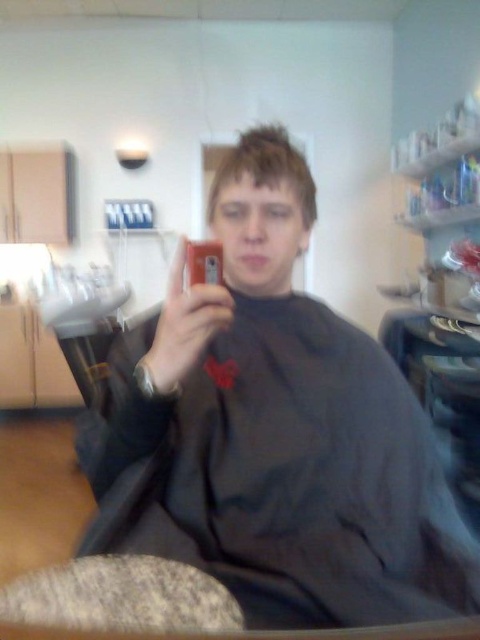
What are the coordinates of the spiky brown hair at center?

The coordinates of the spiky brown hair at center are at point (266, 168).

You are standing in a barbershop and want to take a photo of the point at coordinates (252, 156). If your camera has a focal length of 50mm and you are 33.66 inches away from the point, what is the required distance in millimeters between the camera lens and the image sensor to achieve proper focus?

The required distance between the camera lens and the image sensor to achieve proper focus is calculated using the lens formula 1 focal length equals 1 object distance plus 1 image distance. However, since the focal length is given as 50mm and the object distance is 33.66 inches, first convert inches to millimeters. 33.66 inches is approximately 855 mm. Using the formula 1 50mm equals 1 855mm plus 1 image distance, solving for image distance gives approximately 50.56mm. Therefore, the image sensor should be